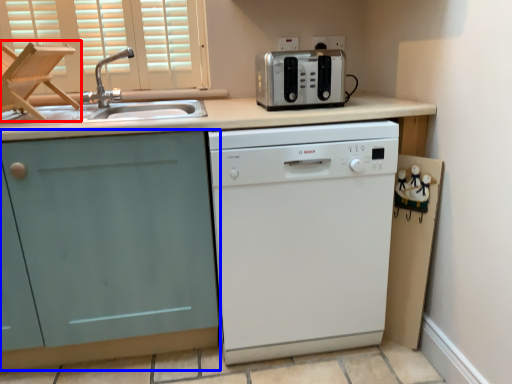
Question: Which object appears closest to the camera in this image, folding chair (highlighted by a red box) or cabinetry (highlighted by a blue box)?

Choices:
 (A) folding chair
 (B) cabinetry

Answer: (B)